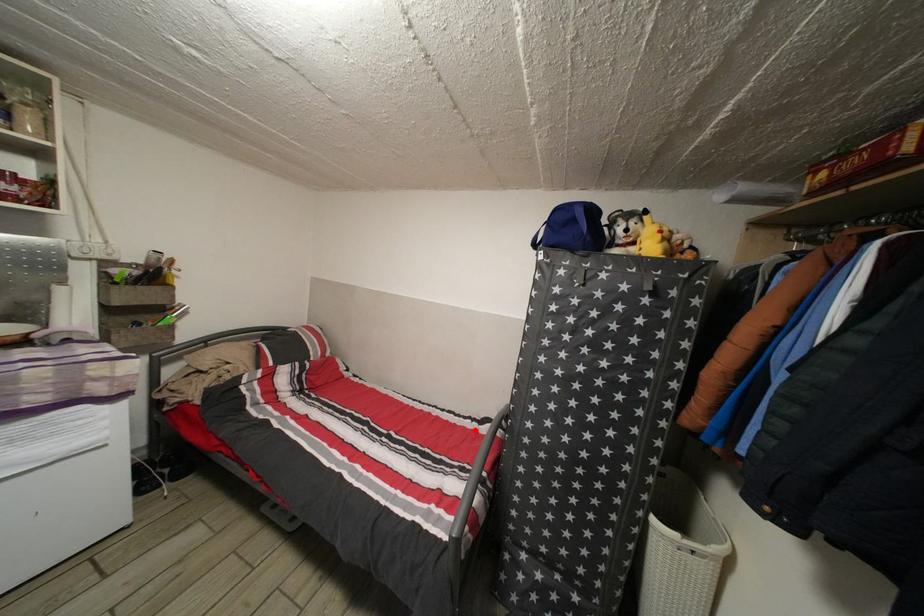
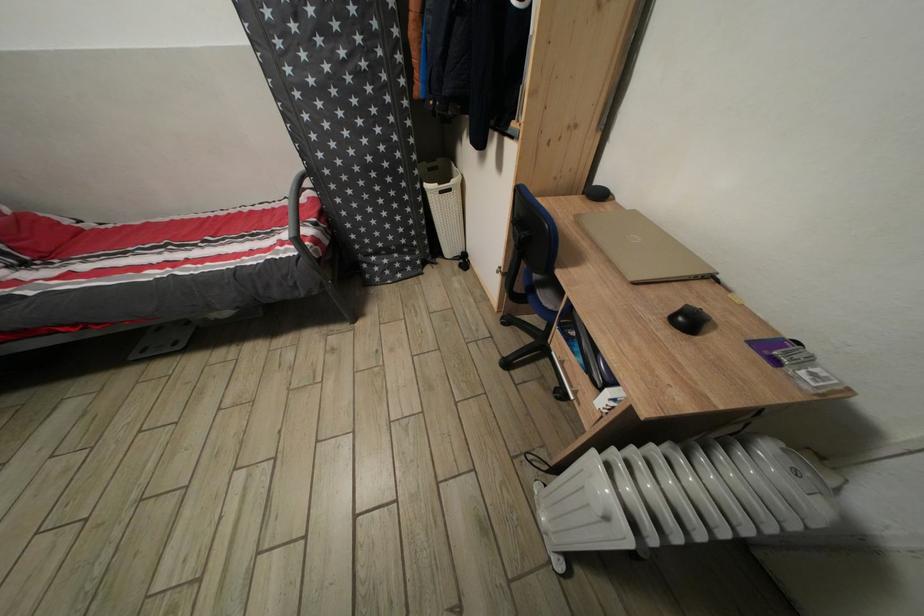
Locate, in the second image, the point that corresponds to the highlighted location in the first image.

(294, 209)